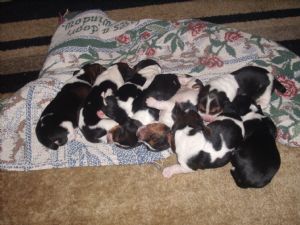
In order to click on brown carpet in this screenshot , I will do point(143,193).